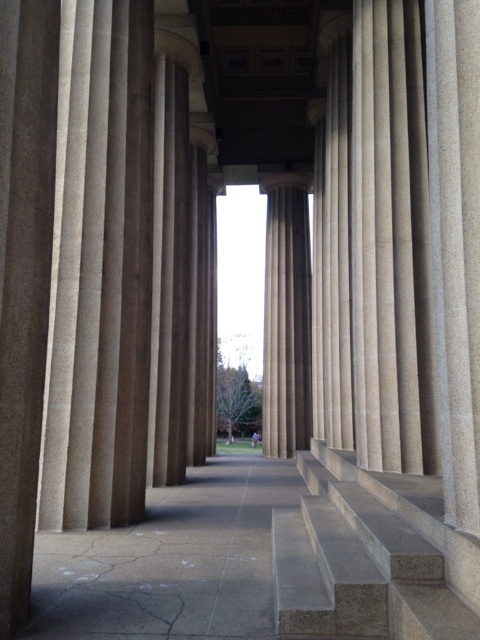
Does beige stone column at center have a greater height compared to smooth concrete stairs at center?

Indeed, beige stone column at center has a greater height compared to smooth concrete stairs at center.

Which is behind, point (411, 129) or point (381, 627)?

Positioned behind is point (411, 129).

Find the location of a particular element. This screenshot has width=480, height=640. beige stone column at center is located at coordinates (388, 237).

Measure the distance between point (112,637) and camera.

They are 2.74 meters apart.

Who is more forward, (x=257, y=506) or (x=290, y=307)?

Point (x=257, y=506)

In order to click on gray concrete pavement at center in this screenshot , I will do `click(170, 561)`.

You are a GUI agent. You are given a task and a screenshot of the screen. Output one action in this format:
    pyautogui.click(x=<x>, y=<y>)
    Task: Click on the beige stone column at center
    
    Given the screenshot: What is the action you would take?
    pyautogui.click(x=388, y=237)

Does beige stone column at center have a lesser height compared to sanded stone column at center?

No, beige stone column at center is not shorter than sanded stone column at center.

Locate an element on the screen. Image resolution: width=480 pixels, height=640 pixels. beige stone column at center is located at coordinates (388, 237).

Find the location of `beige stone column at center`. beige stone column at center is located at coordinates (388, 237).